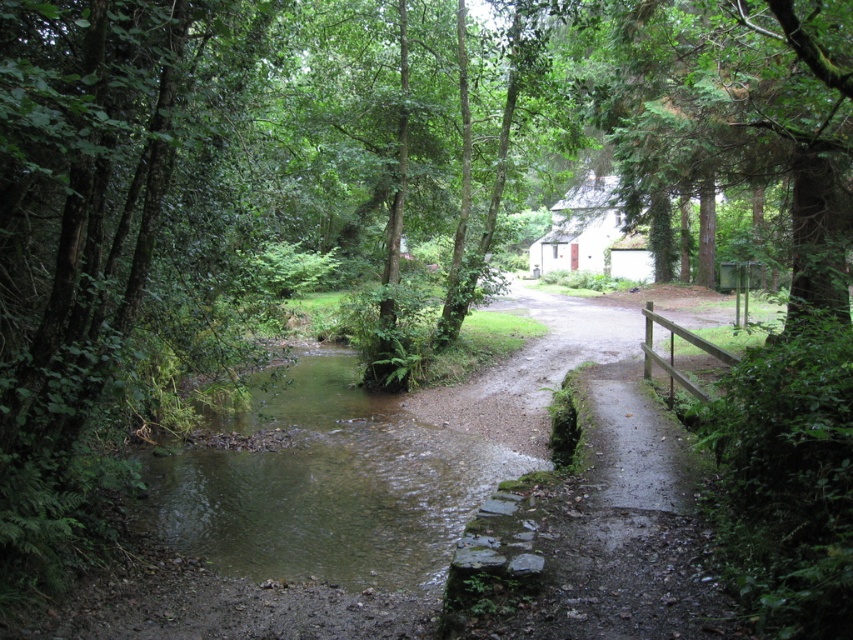
Who is more distant from viewer, (287, 531) or (674, 72)?

Positioned behind is point (674, 72).

Is green mossy stream at center positioned at the back of green leafy tree at upper right?

That is True.

Which is in front, point (416, 484) or point (646, 132)?

Positioned in front is point (416, 484).

Where is `green mossy stream at center`? This screenshot has height=640, width=853. green mossy stream at center is located at coordinates tap(329, 484).